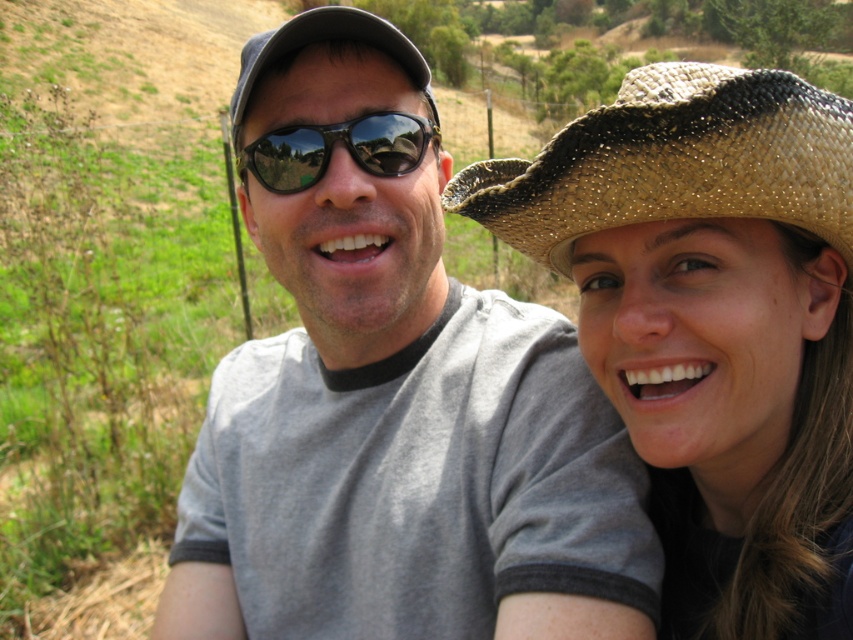
Does woven straw hat at upper right appear on the right side of black reflective sunglasses at center?

Indeed, woven straw hat at upper right is positioned on the right side of black reflective sunglasses at center.

From the picture: Measure the distance between woven straw hat at upper right and camera.

woven straw hat at upper right is 27.14 inches from camera.

Does point (728, 68) come in front of point (277, 192)?

Yes, it is.

Locate an element on the screen. This screenshot has height=640, width=853. woven straw hat at upper right is located at coordinates (675, 161).

Based on the photo, can you confirm if gray t-shirt at center is positioned to the right of black reflective sunglasses at center?

Indeed, gray t-shirt at center is positioned on the right side of black reflective sunglasses at center.

Does point (338, 195) come farther from viewer compared to point (426, 140)?

No, (338, 195) is in front of (426, 140).

This screenshot has height=640, width=853. Identify the location of gray t-shirt at center. (392, 396).

Is natural straw hat at right taller than black reflective sunglasses at center?

Yes.

Who is positioned more to the right, natural straw hat at right or black reflective sunglasses at center?

From the viewer's perspective, natural straw hat at right appears more on the right side.

Is point (677, 186) in front of point (294, 186)?

Yes, point (677, 186) is in front of point (294, 186).

The height and width of the screenshot is (640, 853). Find the location of `natural straw hat at right`. natural straw hat at right is located at coordinates (712, 324).